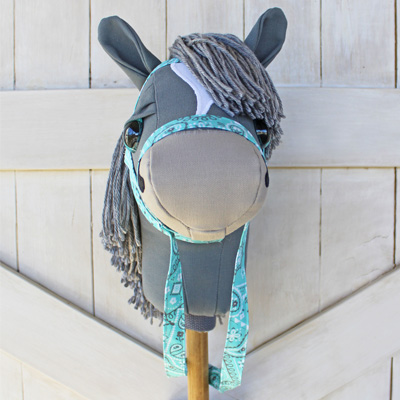
You are a GUI agent. You are given a task and a screenshot of the screen. Output one action in this format:
    pyautogui.click(x=<x>, y=<y>)
    Task: Click on the vertical wooden boards
    This screenshot has height=400, width=400.
    Given the screenshot: What is the action you would take?
    pyautogui.click(x=346, y=56), pyautogui.click(x=295, y=69), pyautogui.click(x=218, y=24), pyautogui.click(x=153, y=33), pyautogui.click(x=36, y=48), pyautogui.click(x=10, y=54)